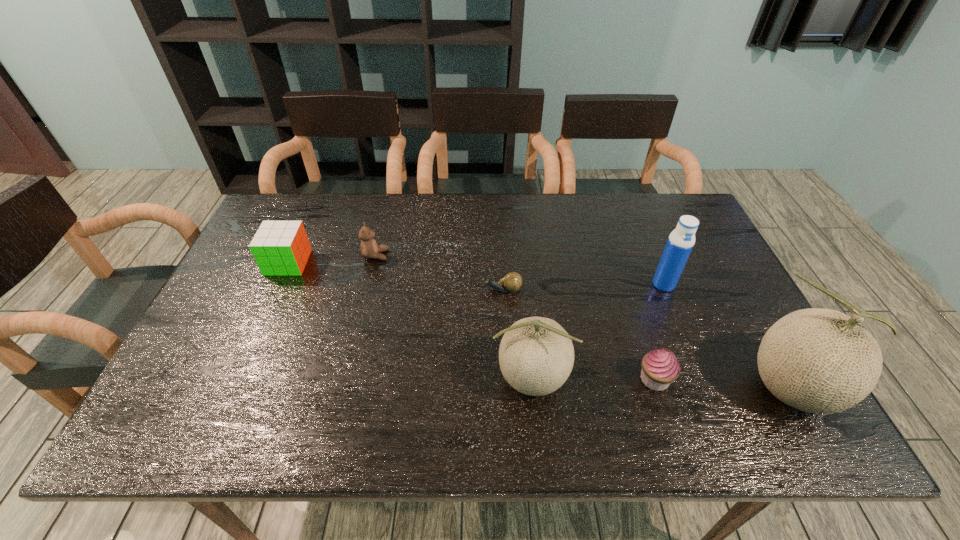
Given the evenly spaced cantaloups in the image, where should an extra cantaloup be added on the left to preserve the spacing? Please point to a vacant space. Please provide its 2D coordinates. Your answer should be formatted as a tuple, i.e. [(x, y)], where the tuple contains the x and y coordinates of a point satisfying the conditions above.

[(276, 369)]